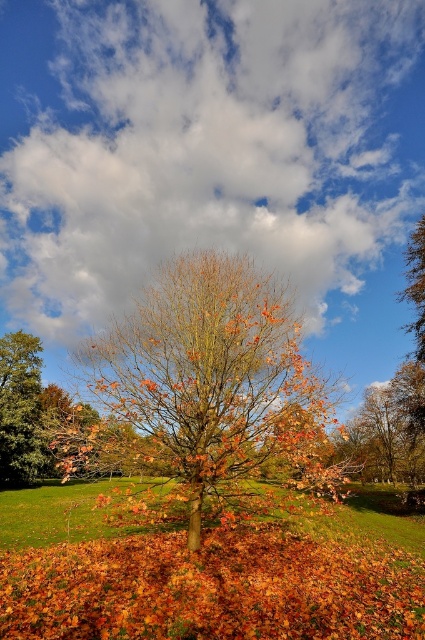
Question: Which point is closer to the camera?

Choices:
 (A) white fluffy cloud at upper center
 (B) green grass at center

Answer: (B)

Question: Is white fluffy cloud at upper center bigger than green grass at center?

Choices:
 (A) yes
 (B) no

Answer: (B)

Question: Is orange-brown bark tree at center closer to the viewer compared to orange-brown leaves at center?

Choices:
 (A) yes
 (B) no

Answer: (A)

Question: Among these points, which one is nearest to the camera?

Choices:
 (A) (286, 76)
 (B) (10, 410)

Answer: (A)

Question: Considering the relative positions of orange-brown bark tree at center and orange-brown leaves at center in the image provided, where is orange-brown bark tree at center located with respect to orange-brown leaves at center?

Choices:
 (A) right
 (B) left

Answer: (A)

Question: Among these objects, which one is farthest from the camera?

Choices:
 (A) orange-brown bark tree at center
 (B) orange-brown leaves at center

Answer: (B)